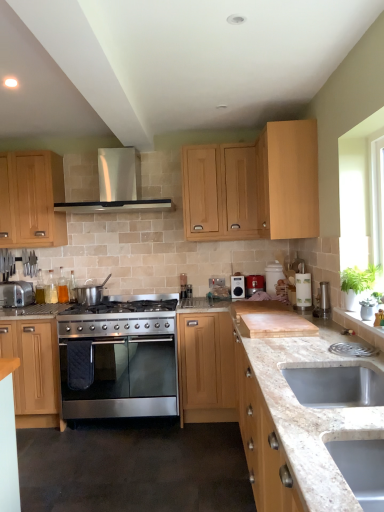
This screenshot has width=384, height=512. Find the location of `light wood cabinet at left, placed as the first cabinetry when sorted from left to right`. light wood cabinet at left, placed as the first cabinetry when sorted from left to right is located at coordinates pos(31,199).

The image size is (384, 512). What do you see at coordinates (31, 199) in the screenshot?
I see `light wood cabinet at left, which ranks as the 5th cabinetry in right-to-left order` at bounding box center [31, 199].

Where is `satin silver coffee machine at center`? satin silver coffee machine at center is located at coordinates point(185,287).

The height and width of the screenshot is (512, 384). What do you see at coordinates (125, 381) in the screenshot? I see `stainless steel oven at center` at bounding box center [125, 381].

At what (x,y) coordinates should I click in order to perform the action: click on matte black microwave at center, which is the third appliance in right-to-left order. Please return your answer as a coordinate pair (x, y). Image resolution: width=384 pixels, height=512 pixels. Looking at the image, I should click on (237, 287).

Measure the distance between metallic silver toaster at center, acting as the second appliance starting from the right, and camera.

A distance of 3.57 meters exists between metallic silver toaster at center, acting as the second appliance starting from the right, and camera.

This screenshot has width=384, height=512. Describe the element at coordinates (311, 422) in the screenshot. I see `white granite countertop at lower right` at that location.

The width and height of the screenshot is (384, 512). Identify the location of translucent glass bottles at left, arranged as the 1th appliance when viewed from the back. (51, 289).

You are a GUI agent. You are given a task and a screenshot of the screen. Output one action in this format:
    pyautogui.click(x=<x>, y=<y>)
    Task: Click on the light wood cabinet at left, placed as the first cabinetry when sorted from left to right
    
    Given the screenshot: What is the action you would take?
    pyautogui.click(x=31, y=199)

Visually, is white ceramic vase at upper right, the first appliance when ordered from right to left, positioned to the left or to the right of matte wood cabinet at left, the fourth cabinetry viewed from the right?

In the image, white ceramic vase at upper right, the first appliance when ordered from right to left, appears on the right side of matte wood cabinet at left, the fourth cabinetry viewed from the right.

How many degrees apart are the facing directions of white ceramic vase at upper right, placed as the 6th appliance when sorted from left to right, and matte wood cabinet at left, the second cabinetry viewed from the left?

white ceramic vase at upper right, placed as the 6th appliance when sorted from left to right, and matte wood cabinet at left, the second cabinetry viewed from the left, are facing 87.4 degrees away from each other.

Image resolution: width=384 pixels, height=512 pixels. Find the location of `cabinetry that is the 4th object located behind the white ceramic vase at upper right, which appears as the 1th appliance when viewed from the front`. cabinetry that is the 4th object located behind the white ceramic vase at upper right, which appears as the 1th appliance when viewed from the front is located at coordinates (34, 371).

From the picture: Who is more distant, white ceramic vase at upper right, placed as the 6th appliance when sorted from left to right, or matte wood cabinet at left, the second cabinetry viewed from the left?

matte wood cabinet at left, the second cabinetry viewed from the left, is further away from the camera.

Which object is positioned more to the left, green leafy plant at right or light wood cabinet at upper center, which appears as the 2th cabinetry when viewed from the right?

Positioned to the left is light wood cabinet at upper center, which appears as the 2th cabinetry when viewed from the right.

Consider the image. Is green leafy plant at right looking in the opposite direction of light wood cabinet at upper center, acting as the 4th cabinetry starting from the left?

No, light wood cabinet at upper center, acting as the 4th cabinetry starting from the left, is not at the back of green leafy plant at right.

Is green leafy plant at right not near light wood cabinet at upper center, which appears as the 2th cabinetry when viewed from the right?

Yes, green leafy plant at right is far from light wood cabinet at upper center, which appears as the 2th cabinetry when viewed from the right.

Where is `cabinetry that is the 2nd object located above the green leafy plant at right (from the image's perspective)`? cabinetry that is the 2nd object located above the green leafy plant at right (from the image's perspective) is located at coordinates (256, 184).

Is point (229, 325) positioned in front of point (50, 285)?

That is True.

Based on the photo, can you confirm if light wood/texture cabinet at center, positioned as the third cabinetry in left-to-right order, is smaller than translucent glass bottles at left, the 6th appliance when ordered from front to back?

No, light wood/texture cabinet at center, positioned as the third cabinetry in left-to-right order, is not smaller than translucent glass bottles at left, the 6th appliance when ordered from front to back.

In the scene shown: Would you say light wood/texture cabinet at center, the third cabinetry positioned from the right, is to the left or to the right of translucent glass bottles at left, the 5th appliance positioned from the right, in the picture?

Based on their positions, light wood/texture cabinet at center, the third cabinetry positioned from the right, is located to the right of translucent glass bottles at left, the 5th appliance positioned from the right.

Starting from the translucent glass bottles at left, the 6th appliance when ordered from front to back, which cabinetry is the 3rd one in front? Please provide its 2D coordinates.

[(206, 368)]

The height and width of the screenshot is (512, 384). I want to click on the 1st appliance located above the matte wood cabinet at left, the second cabinetry viewed from the left (from a real-world perspective), so click(x=237, y=287).

Between matte black microwave at center, acting as the second appliance starting from the back, and matte wood cabinet at left, the fourth cabinetry viewed from the right, which one has more height?

matte wood cabinet at left, the fourth cabinetry viewed from the right.

Is matte wood cabinet at left, the second cabinetry viewed from the left, surrounded by matte black microwave at center, the 4th appliance when ordered from left to right?

No, matte wood cabinet at left, the second cabinetry viewed from the left, is not inside matte black microwave at center, the 4th appliance when ordered from left to right.

How far apart are matte black microwave at center, acting as the second appliance starting from the back, and matte wood cabinet at left, the fourth cabinetry viewed from the right?

The distance of matte black microwave at center, acting as the second appliance starting from the back, from matte wood cabinet at left, the fourth cabinetry viewed from the right, is 5.51 feet.

Is light wood/texture cabinet at center, the third cabinetry positioned from the right, surrounded by light wood cabinet at upper center, acting as the 4th cabinetry starting from the left?

That's incorrect, light wood/texture cabinet at center, the third cabinetry positioned from the right, is not inside light wood cabinet at upper center, acting as the 4th cabinetry starting from the left.

In the scene shown: Between light wood cabinet at upper center, which appears as the 2th cabinetry when viewed from the right, and light wood/texture cabinet at center, positioned as the third cabinetry in left-to-right order, which one has more height?

With more height is light wood cabinet at upper center, which appears as the 2th cabinetry when viewed from the right.

Can you tell me how much light wood cabinet at upper center, acting as the 4th cabinetry starting from the left, and light wood/texture cabinet at center, the third cabinetry positioned from the right, differ in facing direction?

light wood cabinet at upper center, acting as the 4th cabinetry starting from the left, and light wood/texture cabinet at center, the third cabinetry positioned from the right, are facing 0.0562 degrees away from each other.

Does point (138, 188) appear closer or farther from the camera than point (285, 354)?

Point (138, 188).

How far apart are stainless steel exhaust hood at upper center and white granite countertop at lower right?

stainless steel exhaust hood at upper center is 1.97 meters from white granite countertop at lower right.

Is stainless steel exhaust hood at upper center in contact with white granite countertop at lower right?

stainless steel exhaust hood at upper center and white granite countertop at lower right are clearly separated.

Between stainless steel exhaust hood at upper center and white granite countertop at lower right, which one has smaller width?

white granite countertop at lower right is thinner.

Can you confirm if light wood cabinet at upper center, which appears as the 2th cabinetry when viewed from the right, is shorter than stainless steel gas stove at center?

No.

Consider the image. Considering the positions of objects light wood cabinet at upper center, which appears as the 2th cabinetry when viewed from the right, and stainless steel gas stove at center in the image provided, who is behind, light wood cabinet at upper center, which appears as the 2th cabinetry when viewed from the right, or stainless steel gas stove at center?

stainless steel gas stove at center is behind.

What's the angular difference between light wood cabinet at upper center, acting as the 4th cabinetry starting from the left, and stainless steel gas stove at center's facing directions?

There is a 0.658-degree angle between the facing directions of light wood cabinet at upper center, acting as the 4th cabinetry starting from the left, and stainless steel gas stove at center.

From a real-world perspective, count 6th appliances upward from the matte wood cabinet at left, the second cabinetry viewed from the left, and point to it. Please provide its 2D coordinates.

[(367, 309)]

Find the location of `the 1st cabinetry behind the green leafy plant at right`. the 1st cabinetry behind the green leafy plant at right is located at coordinates (256, 184).

Looking at the image, which one is located further to translucent glass bottles at left, the 6th appliance when ordered from front to back, matte black microwave at center, the 4th appliance when ordered from left to right, or stainless steel gas stove at center?

matte black microwave at center, the 4th appliance when ordered from left to right.

When comparing their distances from stainless steel oven at center, does silver metallic toaster at left, the first appliance when ordered from left to right, or translucent glass bottles at left, arranged as the 2th appliance when viewed from the left, seem further?

silver metallic toaster at left, the first appliance when ordered from left to right, is further to stainless steel oven at center.

Which object lies nearer to the anchor point translucent glass bottles at left, the 5th appliance positioned from the right, matte wood cabinet at left, the fourth cabinetry viewed from the right, or white granite countertop at lower right?

The object closer to translucent glass bottles at left, the 5th appliance positioned from the right, is matte wood cabinet at left, the fourth cabinetry viewed from the right.

When comparing their distances from light wood/texture cabinet at center, positioned as the third cabinetry in left-to-right order, does satin silver pot at center, the 3th appliance viewed from the left, or matte black microwave at center, acting as the second appliance starting from the back, seem further?

Among the two, satin silver pot at center, the 3th appliance viewed from the left, is located further to light wood/texture cabinet at center, positioned as the third cabinetry in left-to-right order.

Based on their spatial positions, is satin silver coffee machine at center or satin silver pot at center, the 4th appliance when ordered from right to left, further from stainless steel gas stove at center?

satin silver coffee machine at center is further to stainless steel gas stove at center.

Estimate the real-world distances between objects in this image. Which object is closer to stainless steel oven at center, white ceramic vase at upper right, which is counted as the 6th appliance, starting from the back, or stainless steel gas stove at center?

Among the two, stainless steel gas stove at center is located nearer to stainless steel oven at center.

When comparing their distances from silver metallic toaster at left, which appears as the third appliance when viewed from the front, does white ceramic vase at upper right, which appears as the 1th appliance when viewed from the front, or matte black microwave at center, which is the third appliance in right-to-left order, seem closer?

matte black microwave at center, which is the third appliance in right-to-left order.

Based on their spatial positions, is stainless steel gas stove at center or green leafy plant at right closer to light wood/texture cabinet at center, the third cabinetry positioned from the right?

stainless steel gas stove at center lies closer to light wood/texture cabinet at center, the third cabinetry positioned from the right, than the other object.

Where is `gas stove between white granite countertop at lower right and satin silver pot at center, the 4th appliance when ordered from right to left, in the front-back direction`? Image resolution: width=384 pixels, height=512 pixels. gas stove between white granite countertop at lower right and satin silver pot at center, the 4th appliance when ordered from right to left, in the front-back direction is located at coordinates (117, 318).

Where is `window screen between white granite countertop at lower right and metallic silver toaster at center, acting as the second appliance starting from the right, along the z-axis`? This screenshot has width=384, height=512. window screen between white granite countertop at lower right and metallic silver toaster at center, acting as the second appliance starting from the right, along the z-axis is located at coordinates 362,193.

Where is `exhaust hood situated between satin silver pot at center, the 4th appliance when ordered from right to left, and metallic silver toaster at center, acting as the second appliance starting from the right, from left to right`? This screenshot has width=384, height=512. exhaust hood situated between satin silver pot at center, the 4th appliance when ordered from right to left, and metallic silver toaster at center, acting as the second appliance starting from the right, from left to right is located at coordinates (117, 186).

You are a GUI agent. You are given a task and a screenshot of the screen. Output one action in this format:
    pyautogui.click(x=<x>, y=<y>)
    Task: Click on the exhaust hood between white ceramic vase at upper right, which is counted as the 6th appliance, starting from the back, and metallic silver toaster at center, placed as the fifth appliance when sorted from left to right, from front to back
    This screenshot has height=512, width=384.
    Given the screenshot: What is the action you would take?
    pyautogui.click(x=117, y=186)